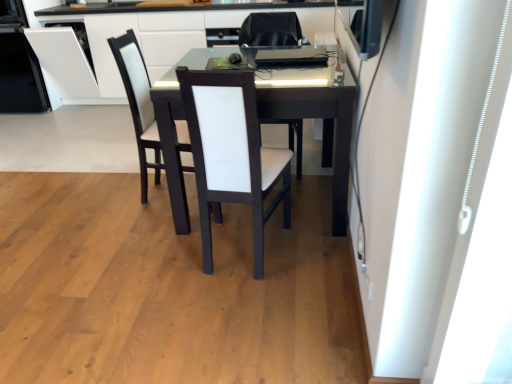
The image size is (512, 384). What are the coordinates of `vacant area that lies between white leather chair at center, the first chair in the front-to-back sequence, and white leather chair at center, acting as the second chair starting from the front` in the screenshot? It's located at (278, 246).